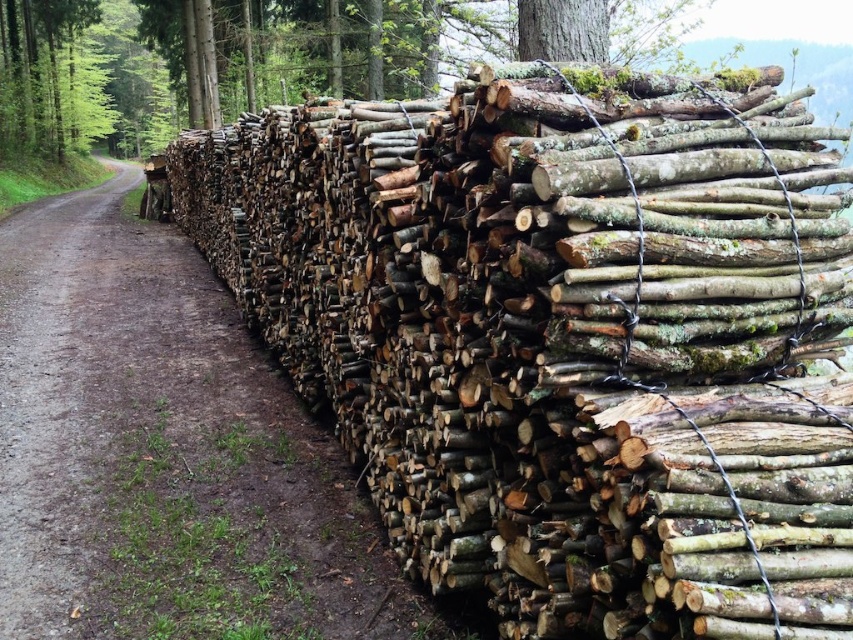
Question: Does natural wood logs at right have a greater width compared to green rough bark tree trunk at upper center?

Choices:
 (A) yes
 (B) no

Answer: (A)

Question: Can you confirm if green mossy bark at upper center is positioned above green rough bark tree trunk at upper center?

Choices:
 (A) yes
 (B) no

Answer: (B)

Question: Considering the real-world distances, which object is farthest from the green mossy bark at upper center?

Choices:
 (A) green rough bark tree trunk at upper center
 (B) natural wood logs at right

Answer: (A)

Question: Which object is the farthest from the natural wood logs at right?

Choices:
 (A) green rough bark tree trunk at upper center
 (B) green mossy bark at upper center

Answer: (A)

Question: Does natural wood logs at right have a greater width compared to green mossy bark at upper center?

Choices:
 (A) yes
 (B) no

Answer: (A)

Question: Which object appears closest to the camera in this image?

Choices:
 (A) green rough bark tree trunk at upper center
 (B) natural wood logs at right
 (C) green mossy bark at upper center

Answer: (B)